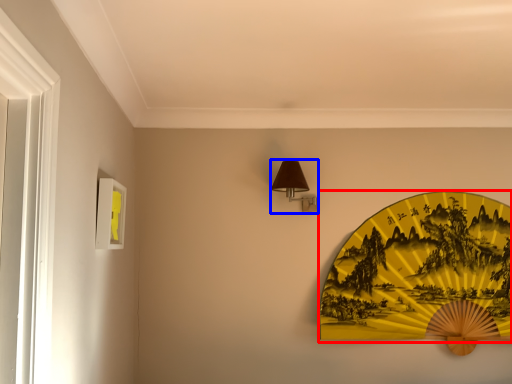
Question: Which of the following is the farthest to the observer, design (highlighted by a red box) or table lamp (highlighted by a blue box)?

Choices:
 (A) design
 (B) table lamp

Answer: (A)